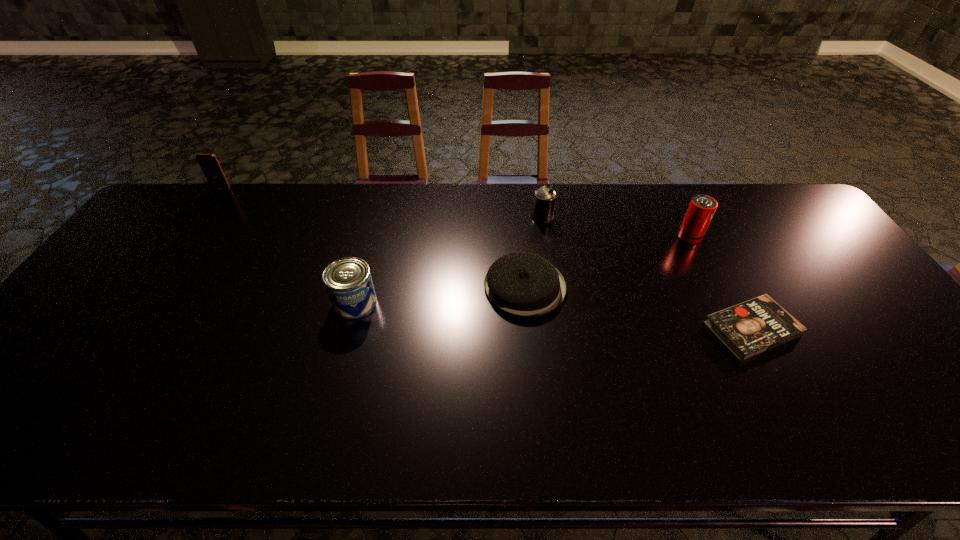
Identify the location of free point that satisfies the following two spatial constraints: 1. on the screen of the cellular telephone; 2. on the left side of the book. point(125,329).

This screenshot has width=960, height=540. Find the location of `vacant area in the image that satisfies the following two spatial constraints: 1. on the screen of the leftmost object; 2. on the right side of the pancake`. vacant area in the image that satisfies the following two spatial constraints: 1. on the screen of the leftmost object; 2. on the right side of the pancake is located at coordinates (155, 287).

This screenshot has height=540, width=960. What are the coordinates of `free point that satisfies the following two spatial constraints: 1. on the screen of the shortest object; 2. on the left side of the leftmost object` in the screenshot? It's located at (125, 329).